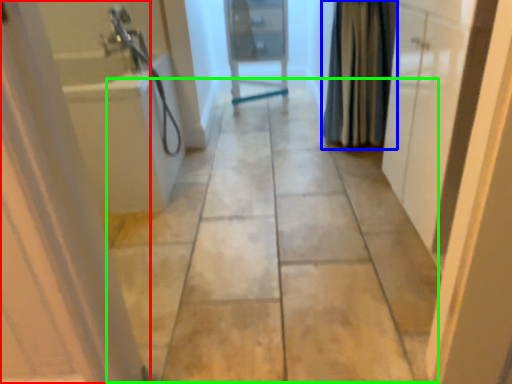
Question: Which object is the farthest from door (highlighted by a red box)? Choose among these: shower curtain (highlighted by a blue box) or path (highlighted by a green box).

Choices:
 (A) shower curtain
 (B) path

Answer: (A)